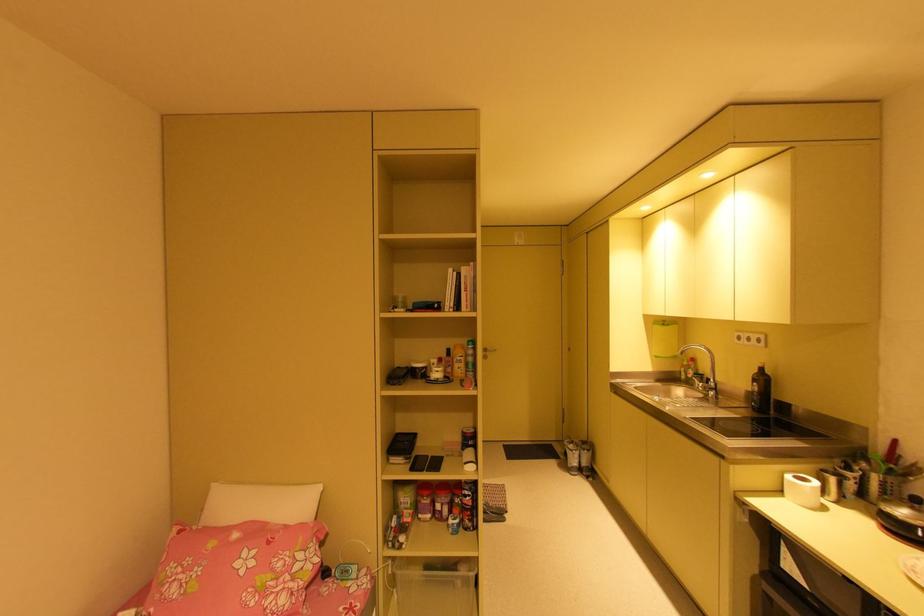
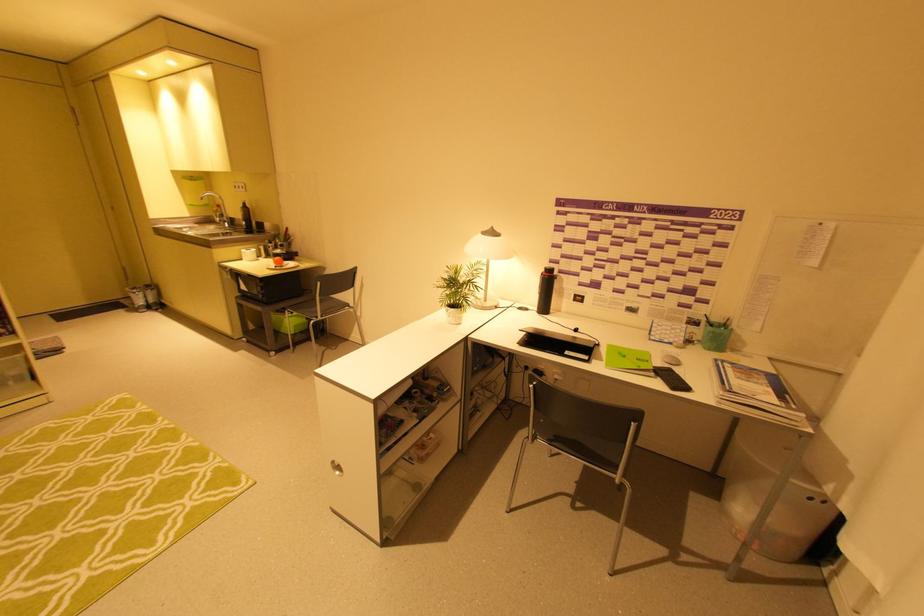
Where in the second image is the point corresponding to point 578,455 from the first image?

(142, 296)